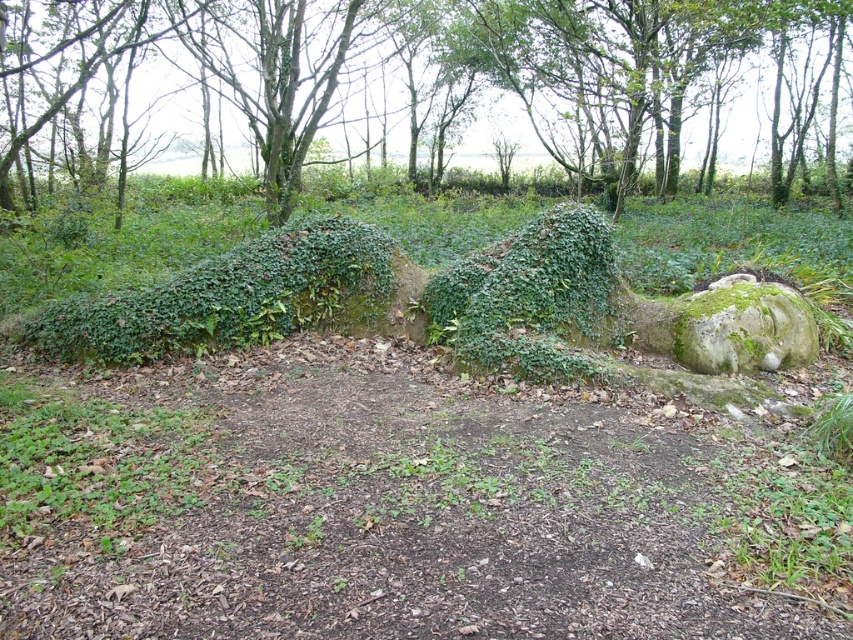
Question: Can you confirm if green mossy rock at center is bigger than green mossy hedge at center?

Choices:
 (A) no
 (B) yes

Answer: (B)

Question: Can you confirm if green mossy rock at center is smaller than green mossy hedge at center?

Choices:
 (A) yes
 (B) no

Answer: (B)

Question: Is green mossy rock at center further to the viewer compared to green mossy hedge at center?

Choices:
 (A) yes
 (B) no

Answer: (A)

Question: Which point appears closest to the camera in this image?

Choices:
 (A) (294, 296)
 (B) (465, 22)

Answer: (A)